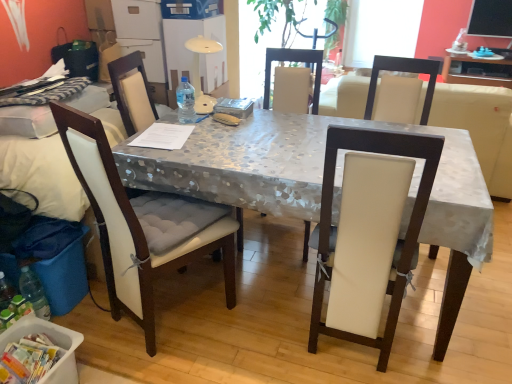
This screenshot has width=512, height=384. Describe the element at coordinates (132, 227) in the screenshot. I see `white fabric chair at left, the 3th chair in the right-to-left sequence` at that location.

This screenshot has height=384, width=512. Identify the location of matte gray table at upper right. (478, 72).

Locate an element on the screen. Image resolution: width=512 pixels, height=384 pixels. white leather couch at center is located at coordinates (480, 127).

Where is `metallic silver table at center`? metallic silver table at center is located at coordinates (320, 184).

Where is `white fabric chair at left, the 1th chair viewed from the left`? The height and width of the screenshot is (384, 512). white fabric chair at left, the 1th chair viewed from the left is located at coordinates (132, 227).

Which is correct: white fabric chair at left, the 3th chair in the right-to-left sequence, is inside white plastic container at lower left, or outside of it?

white fabric chair at left, the 3th chair in the right-to-left sequence, lies outside white plastic container at lower left.

This screenshot has height=384, width=512. In order to click on box on the left of the white fabric chair at left, the 3th chair in the right-to-left sequence in this screenshot , I will do `click(52, 341)`.

How distant is white fabric chair at left, the 3th chair in the right-to-left sequence, from white plastic container at lower left?

white fabric chair at left, the 3th chair in the right-to-left sequence, is 44.38 centimeters from white plastic container at lower left.

Is there a large distance between white fabric chair at left, the 3th chair in the right-to-left sequence, and white plastic container at lower left?

That's not correct — white fabric chair at left, the 3th chair in the right-to-left sequence, is a little close to white plastic container at lower left.

Which is correct: white fabric chair at left, the 3th chair in the right-to-left sequence, is inside transparent plastic bottle at center, or outside of it?

The correct answer is: outside.

Can you confirm if white fabric chair at left, the 1th chair viewed from the left, is bigger than transparent plastic bottle at center?

Correct, white fabric chair at left, the 1th chair viewed from the left, is larger in size than transparent plastic bottle at center.

Which is in front, point (219, 225) or point (193, 90)?

Point (219, 225)

Locate an element on the screen. The image size is (512, 384). chair that is the 2nd object located in front of the transparent plastic bottle at center is located at coordinates (132, 227).

Is the surface of blue plastic trash bin at lower left in direct contact with metallic silver table at center?

No, blue plastic trash bin at lower left is not beside metallic silver table at center.

Is point (67, 267) behind point (247, 200)?

Yes, it is.

Considering the relative sizes of blue plastic trash bin at lower left and metallic silver table at center in the image provided, is blue plastic trash bin at lower left shorter than metallic silver table at center?

Indeed, blue plastic trash bin at lower left has a lesser height compared to metallic silver table at center.

From a real-world perspective, is blue plastic trash bin at lower left physically located above or below metallic silver table at center?

From a real-world perspective, blue plastic trash bin at lower left is physically below metallic silver table at center.

Is white plastic container at lower left situated inside metallic silver table at center or outside?

white plastic container at lower left is spatially situated outside metallic silver table at center.

Does white plastic container at lower left have a smaller size compared to metallic silver table at center?

Yes, white plastic container at lower left is smaller than metallic silver table at center.

From a real-world perspective, is white plastic container at lower left below metallic silver table at center?

Indeed, from a real-world perspective, white plastic container at lower left is positioned beneath metallic silver table at center.

Is point (45, 377) positioned in front of point (279, 200)?

Yes, point (45, 377) is closer to viewer.

From the image's perspective, is matte gray table at upper right located above or below white leather couch at center?

matte gray table at upper right is above white leather couch at center.

Is point (454, 58) positioned in front of point (502, 132)?

Yes, it is in front of point (502, 132).

Can you confirm if matte gray table at upper right is positioned to the left of white leather couch at center?

In fact, matte gray table at upper right is to the right of white leather couch at center.

Locate an element on the screen. The image size is (512, 384). table that is under the white leather couch at center (from a real-world perspective) is located at coordinates (478, 72).

Find the location of a particular element. This screenshot has height=384, width=512. table above the metallic silver table at center (from the image's perspective) is located at coordinates (478, 72).

Is the position of metallic silver table at center less distant than that of matte gray table at upper right?

Yes, metallic silver table at center is closer to the viewer.

From a real-world perspective, is metallic silver table at center positioned above or below matte gray table at upper right?

metallic silver table at center is above matte gray table at upper right.

Is metallic silver table at center wider than matte gray table at upper right?

Yes.

Is point (266, 164) in front of point (323, 215)?

That is False.

Can you confirm if metallic silver table at center is shorter than white leather chair at center, marked as the 1th chair in a right-to-left arrangement?

Indeed, metallic silver table at center has a lesser height compared to white leather chair at center, marked as the 1th chair in a right-to-left arrangement.

Is metallic silver table at center turned away from white leather chair at center, marked as the 1th chair in a right-to-left arrangement?

No, white leather chair at center, marked as the 1th chair in a right-to-left arrangement, is not at the back of metallic silver table at center.

Is metallic silver table at center at the left side of white leather chair at center, marked as the 1th chair in a right-to-left arrangement?

Correct, you'll find metallic silver table at center to the left of white leather chair at center, marked as the 1th chair in a right-to-left arrangement.

Identify the location of box directly beneath the white fabric chair at left, the 3th chair in the right-to-left sequence (from a real-world perspective). (52, 341).

Where is `bottle that is on the right side of white fabric chair at left, the 3th chair in the right-to-left sequence`? The height and width of the screenshot is (384, 512). bottle that is on the right side of white fabric chair at left, the 3th chair in the right-to-left sequence is located at coordinates (185, 102).

Considering their positions, is matte gray table at upper right positioned further to white fabric chair at left, which ranks as the second chair in left-to-right order, than white leather chair at center, the third chair viewed from the left?

matte gray table at upper right lies further to white fabric chair at left, which ranks as the second chair in left-to-right order, than the other object.

Looking at the image, which one is located further to white plastic container at lower left, transparent plastic bottle at center or matte gray table at upper right?

Among the two, matte gray table at upper right is located further to white plastic container at lower left.

Estimate the real-world distances between objects in this image. Which object is closer to white fabric chair at left, the 1th chair viewed from the left, white leather chair at center, marked as the 1th chair in a right-to-left arrangement, or matte gray table at upper right?

white leather chair at center, marked as the 1th chair in a right-to-left arrangement, is closer to white fabric chair at left, the 1th chair viewed from the left.

Looking at this image, when comparing their distances from white leather chair at center, marked as the 1th chair in a right-to-left arrangement, does white fabric chair at left, the 2th chair in the right-to-left sequence, or metallic silver table at center seem closer?

metallic silver table at center.

When comparing their distances from transparent plastic bottle at center, does white leather chair at center, the third chair viewed from the left, or metallic silver table at center seem further?

white leather chair at center, the third chair viewed from the left, is positioned further to the anchor transparent plastic bottle at center.

From the image, which object appears to be nearer to blue plastic trash bin at lower left, metallic silver table at center or white fabric chair at left, the 2th chair in the right-to-left sequence?

The object closer to blue plastic trash bin at lower left is white fabric chair at left, the 2th chair in the right-to-left sequence.

Estimate the real-world distances between objects in this image. Which object is closer to white fabric chair at left, which ranks as the second chair in left-to-right order, white leather chair at center, the third chair viewed from the left, or white leather couch at center?

white leather chair at center, the third chair viewed from the left, lies closer to white fabric chair at left, which ranks as the second chair in left-to-right order, than the other object.

In the scene shown: Looking at the image, which one is located closer to matte gray table at upper right, blue plastic trash bin at lower left or white leather chair at center, marked as the 1th chair in a right-to-left arrangement?

Based on the image, white leather chair at center, marked as the 1th chair in a right-to-left arrangement, appears to be nearer to matte gray table at upper right.

The image size is (512, 384). Find the location of `bottle situated between blue plastic trash bin at lower left and white leather chair at center, the third chair viewed from the left, from left to right`. bottle situated between blue plastic trash bin at lower left and white leather chair at center, the third chair viewed from the left, from left to right is located at coordinates (185, 102).

Image resolution: width=512 pixels, height=384 pixels. In order to click on desk located between white leather chair at center, marked as the 1th chair in a right-to-left arrangement, and white leather couch at center in the depth direction in this screenshot , I will do `click(320, 184)`.

Where is `desk between transparent plastic bottle at center and white plastic container at lower left in the vertical direction`? This screenshot has width=512, height=384. desk between transparent plastic bottle at center and white plastic container at lower left in the vertical direction is located at coordinates (320, 184).

You are a GUI agent. You are given a task and a screenshot of the screen. Output one action in this format:
    pyautogui.click(x=<x>, y=<y>)
    Task: Click on the chair situated between white fabric chair at left, the 3th chair in the right-to-left sequence, and metallic silver table at center from left to right
    The image size is (512, 384).
    Given the screenshot: What is the action you would take?
    pyautogui.click(x=132, y=92)